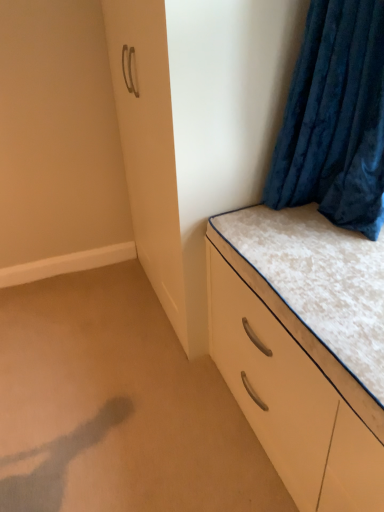
What do you see at coordinates (335, 119) in the screenshot?
I see `velvet blue curtain at upper right` at bounding box center [335, 119].

Find the location of a particular element. The height and width of the screenshot is (512, 384). velvet blue curtain at upper right is located at coordinates (335, 119).

Between beige carpet at lower left and white glossy chest of drawers at lower right, which one appears on the right side from the viewer's perspective?

Positioned to the right is white glossy chest of drawers at lower right.

Is beige carpet at lower left beside white glossy chest of drawers at lower right?

They are not placed beside each other.

Does point (179, 354) appear closer or farther from the camera than point (285, 416)?

Point (179, 354).

Which object is closer to the camera, beige carpet at lower left or white glossy chest of drawers at lower right?

white glossy chest of drawers at lower right is closer to the camera.

Does white glossy chest of drawers at lower right have a greater width compared to beige carpet at lower left?

Incorrect, the width of white glossy chest of drawers at lower right does not surpass that of beige carpet at lower left.

From the image's perspective, would you say white glossy chest of drawers at lower right is positioned over beige carpet at lower left?

Yes, from the image's perspective, white glossy chest of drawers at lower right is above beige carpet at lower left.

Locate an element on the screen. The width and height of the screenshot is (384, 512). the chest of drawers that is in front of the beige carpet at lower left is located at coordinates [x=303, y=348].

Would you say white glossy chest of drawers at lower right is inside or outside beige carpet at lower left?

white glossy chest of drawers at lower right cannot be found inside beige carpet at lower left.

Based on the photo, in terms of height, does white glossy chest of drawers at lower right look taller or shorter compared to velvet blue curtain at upper right?

white glossy chest of drawers at lower right is shorter than velvet blue curtain at upper right.

Can you confirm if white glossy chest of drawers at lower right is thinner than velvet blue curtain at upper right?

In fact, white glossy chest of drawers at lower right might be wider than velvet blue curtain at upper right.

Which is in front, point (259, 266) or point (319, 81)?

The point (259, 266) is in front.

Is white glossy chest of drawers at lower right aimed at velvet blue curtain at upper right?

No, white glossy chest of drawers at lower right is not turned towards velvet blue curtain at upper right.

Which object is further away from the camera, velvet blue curtain at upper right or beige carpet at lower left?

beige carpet at lower left is behind.

Can we say velvet blue curtain at upper right lies outside beige carpet at lower left?

Yes, velvet blue curtain at upper right is located beyond the bounds of beige carpet at lower left.

Between velvet blue curtain at upper right and beige carpet at lower left, which one has larger width?

Wider between the two is beige carpet at lower left.

Is velvet blue curtain at upper right taller or shorter than beige carpet at lower left?

Considering their sizes, velvet blue curtain at upper right has more height than beige carpet at lower left.

Is velvet blue curtain at upper right shorter than white glossy chest of drawers at lower right?

Incorrect, the height of velvet blue curtain at upper right does not fall short of that of white glossy chest of drawers at lower right.

Would you say velvet blue curtain at upper right contains white glossy chest of drawers at lower right?

No, white glossy chest of drawers at lower right is located outside of velvet blue curtain at upper right.

Considering the relative positions of velvet blue curtain at upper right and white glossy chest of drawers at lower right in the image provided, is velvet blue curtain at upper right to the right of white glossy chest of drawers at lower right from the viewer's perspective?

Yes, velvet blue curtain at upper right is to the right of white glossy chest of drawers at lower right.

Is beige carpet at lower left directly adjacent to velvet blue curtain at upper right?

No, beige carpet at lower left is not with velvet blue curtain at upper right.

Considering the relative sizes of beige carpet at lower left and velvet blue curtain at upper right in the image provided, is beige carpet at lower left smaller than velvet blue curtain at upper right?

No.

Which object is wider, beige carpet at lower left or velvet blue curtain at upper right?

beige carpet at lower left.

Is beige carpet at lower left surrounding velvet blue curtain at upper right?

No, velvet blue curtain at upper right is not surrounded by beige carpet at lower left.

You are a GUI agent. You are given a task and a screenshot of the screen. Output one action in this format:
    pyautogui.click(x=<x>, y=<y>)
    Task: Click on the plain lying behind the white glossy chest of drawers at lower right
    
    Given the screenshot: What is the action you would take?
    pyautogui.click(x=117, y=406)

Identify the location of plain that is on the left side of white glossy chest of drawers at lower right. This screenshot has width=384, height=512. (117, 406).

When comparing their distances from velvet blue curtain at upper right, does white glossy chest of drawers at lower right or beige carpet at lower left seem closer?

white glossy chest of drawers at lower right is positioned closer to the anchor velvet blue curtain at upper right.

From the image, which object appears to be nearer to beige carpet at lower left, velvet blue curtain at upper right or white glossy chest of drawers at lower right?

white glossy chest of drawers at lower right is closer to beige carpet at lower left.

Considering their positions, is beige carpet at lower left positioned further to velvet blue curtain at upper right than white glossy chest of drawers at lower right?

beige carpet at lower left is further to velvet blue curtain at upper right.

When comparing their distances from beige carpet at lower left, does white glossy chest of drawers at lower right or velvet blue curtain at upper right seem closer?

white glossy chest of drawers at lower right.

Looking at the image, which one is located further to white glossy chest of drawers at lower right, velvet blue curtain at upper right or beige carpet at lower left?

beige carpet at lower left is further to white glossy chest of drawers at lower right.

From the image, which object appears to be nearer to white glossy chest of drawers at lower right, beige carpet at lower left or velvet blue curtain at upper right?

velvet blue curtain at upper right.

In order to click on chest of drawers between velvet blue curtain at upper right and beige carpet at lower left from top to bottom in this screenshot , I will do `click(303, 348)`.